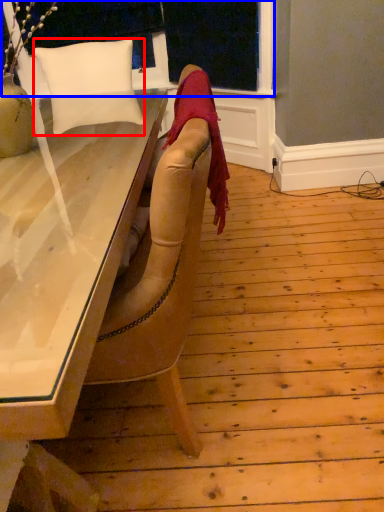
Question: Which point is closer to the camera, pillow (highlighted by a red box) or window frame (highlighted by a blue box)?

Choices:
 (A) pillow
 (B) window frame

Answer: (A)